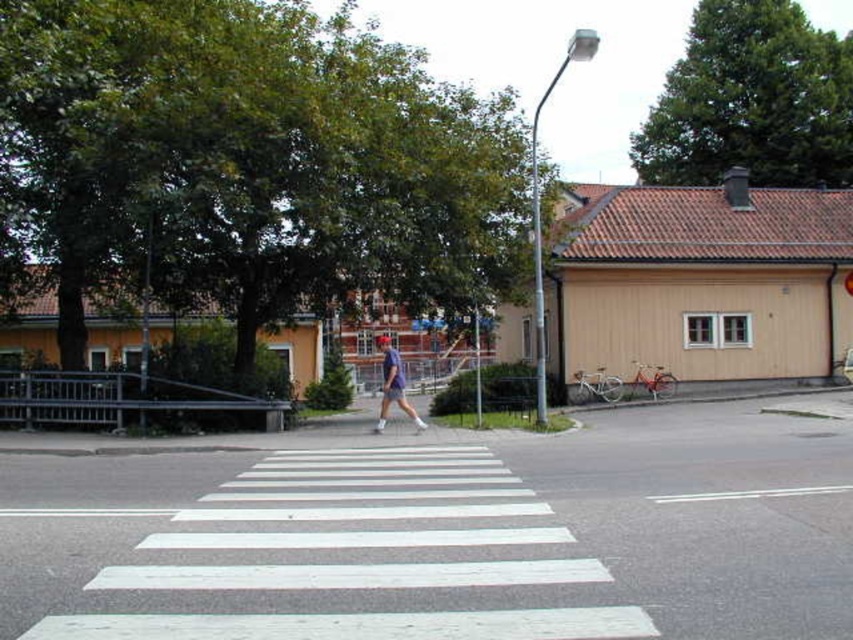
Which is more to the right, white painted crosswalk at center or blue fabric shorts at center?

blue fabric shorts at center is more to the right.

Where is `white painted crosswalk at center`? white painted crosswalk at center is located at coordinates (300, 554).